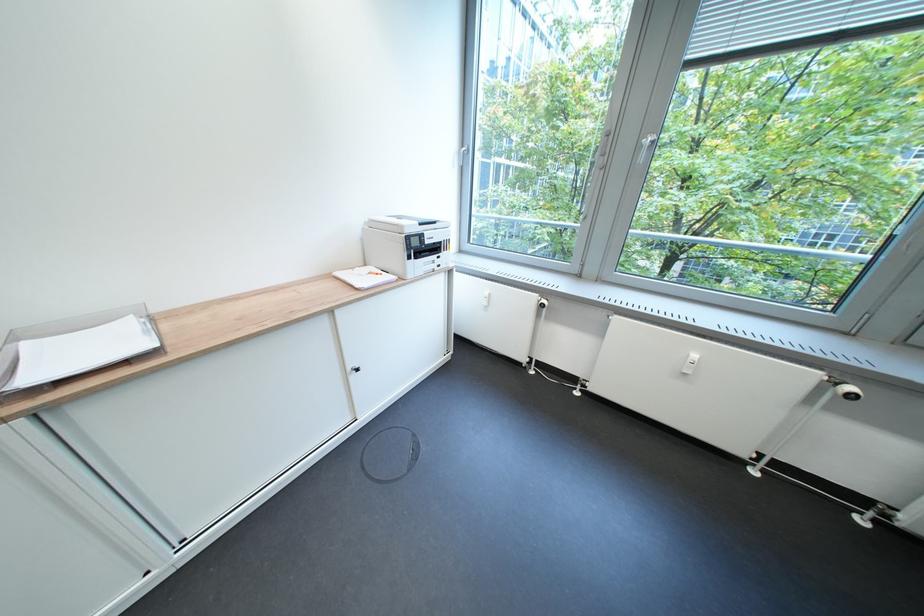
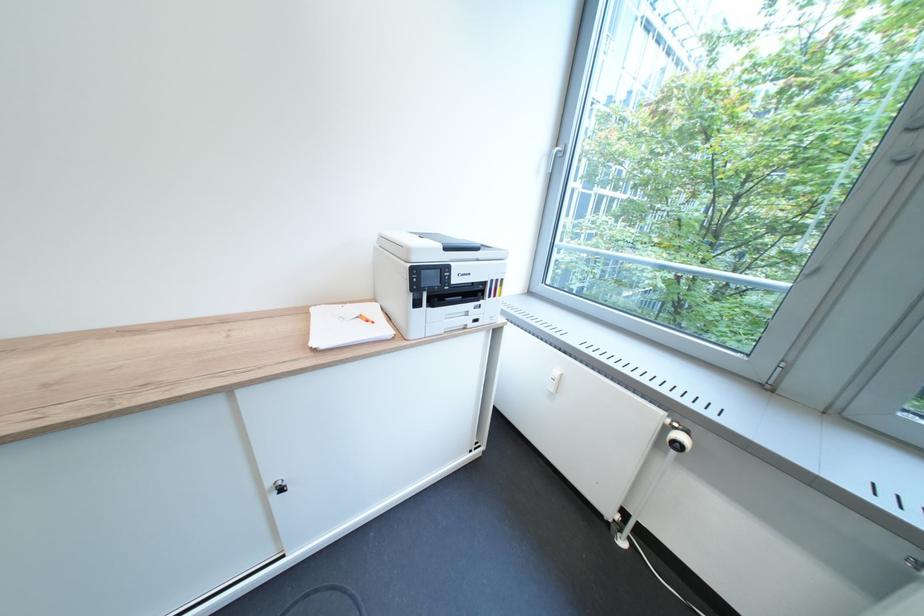
Find the pixel in the second image that matches [360,371] in the first image.

(282, 485)